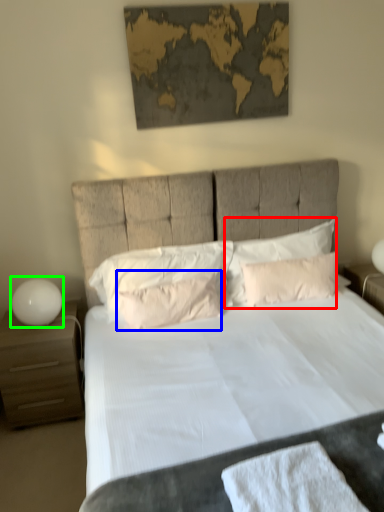
Question: Which object is the farthest from pillow (highlighted by a red box)? Choose among these: pillow (highlighted by a blue box) or table lamp (highlighted by a green box).

Choices:
 (A) pillow
 (B) table lamp

Answer: (B)